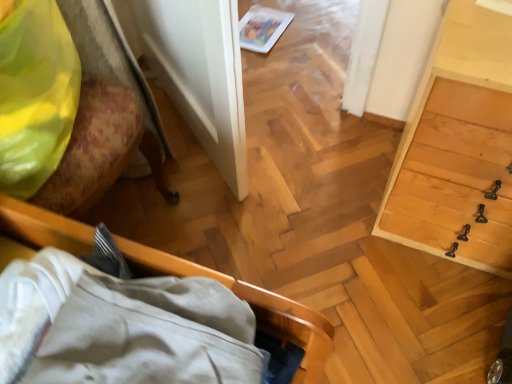
Image resolution: width=512 pixels, height=384 pixels. What are the coordinates of `vacant region under white glossy magazine at upper center (from a real-world perspective)` in the screenshot? It's located at (259, 28).